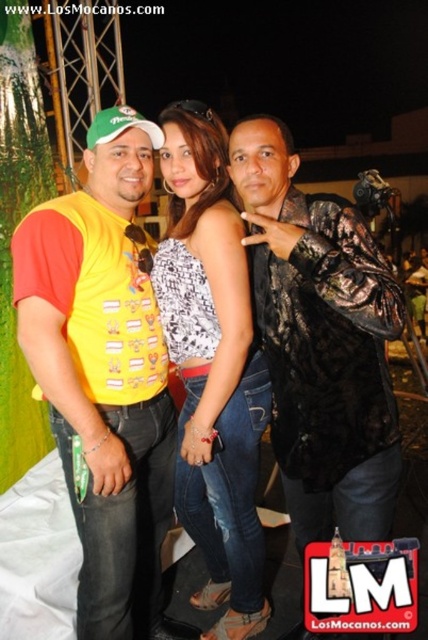
Does point (95, 566) come closer to viewer compared to point (284, 413)?

Yes.

Can you confirm if yellow printed t-shirt at left is positioned above shiny black jacket at center?

No.

Find the location of a particular element. This screenshot has width=428, height=640. yellow printed t-shirt at left is located at coordinates (104, 374).

Where is `yellow printed t-shirt at left`? yellow printed t-shirt at left is located at coordinates pyautogui.click(x=104, y=374).

Which is more to the left, yellow printed t-shirt at left or white printed tank top at center?

yellow printed t-shirt at left is more to the left.

What do you see at coordinates (104, 374) in the screenshot? I see `yellow printed t-shirt at left` at bounding box center [104, 374].

Identify the location of yellow printed t-shirt at left. (104, 374).

How distant is shiny black jacket at center from white printed tank top at center?

10.65 inches

Can you confirm if shiny black jacket at center is bigger than white printed tank top at center?

Yes.

Which is in front, point (297, 397) or point (216, 628)?

Point (297, 397) is more forward.

Where is `shiny black jacket at center`? shiny black jacket at center is located at coordinates (321, 340).